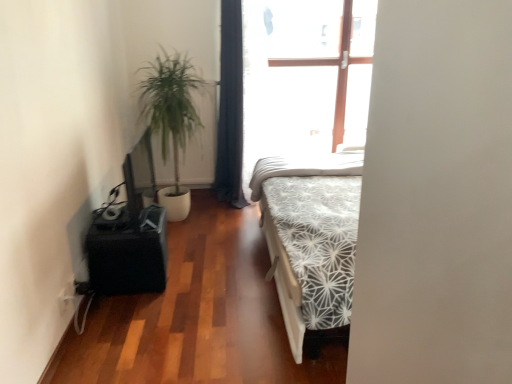
The image size is (512, 384). Describe the element at coordinates (305, 167) in the screenshot. I see `white textured mattress at center` at that location.

Where is `black matte table at left`? black matte table at left is located at coordinates (128, 253).

Image resolution: width=512 pixels, height=384 pixels. What are the coordinates of `white textured mattress at center` in the screenshot? It's located at (305, 167).

Between point (241, 164) and point (163, 204), which one is positioned in front?

Positioned in front is point (163, 204).

From the image's perspective, is dark blue fabric curtain at center positioned above or below green leafy plant at left?

From the image's perspective, dark blue fabric curtain at center appears above green leafy plant at left.

Where is `curtain that appears above the green leafy plant at left (from a real-world perspective)`? curtain that appears above the green leafy plant at left (from a real-world perspective) is located at coordinates (230, 109).

Is green leafy plant at left surrounding white textured screen door at center?

No, white textured screen door at center is located outside of green leafy plant at left.

Which is behind, green leafy plant at left or white textured screen door at center?

green leafy plant at left is further away from the camera.

From their relative heights in the image, would you say green leafy plant at left is taller or shorter than white textured screen door at center?

In the image, green leafy plant at left appears to be taller than white textured screen door at center.

Based on their sizes in the image, would you say green leafy plant at left is bigger or smaller than white textured screen door at center?

In the image, green leafy plant at left appears to be smaller than white textured screen door at center.

How different are the orientations of white textured mattress at center and dark blue fabric curtain at center in degrees?

The facing directions of white textured mattress at center and dark blue fabric curtain at center are 91.4 degrees apart.

Is white textured mattress at center next to dark blue fabric curtain at center?

white textured mattress at center and dark blue fabric curtain at center are clearly separated.

From a real-world perspective, between white textured mattress at center and dark blue fabric curtain at center, who is vertically higher?

dark blue fabric curtain at center.

Is white textured mattress at center to the right of dark blue fabric curtain at center from the viewer's perspective?

Yes, white textured mattress at center is to the right of dark blue fabric curtain at center.

Based on the photo, are white textured mattress at center and white textured screen door at center beside each other?

white textured mattress at center and white textured screen door at center are clearly separated.

Looking at this image, between white textured mattress at center and white textured screen door at center, which one has more height?

Standing taller between the two is white textured screen door at center.

Can you tell me how much white textured mattress at center and white textured screen door at center differ in facing direction?

They differ by 0.784 degrees in their facing directions.

What are the coordinates of `mattress that is behind the white textured screen door at center` in the screenshot? It's located at (305, 167).

Considering the positions of point (283, 160) and point (101, 252), is point (283, 160) closer or farther from the camera than point (101, 252)?

Point (283, 160) is farther from the camera than point (101, 252).

Where is `table on the left of white textured mattress at center`? The height and width of the screenshot is (384, 512). table on the left of white textured mattress at center is located at coordinates (128, 253).

Which is more to the right, white textured mattress at center or black matte table at left?

white textured mattress at center is more to the right.

Is white textured mattress at center in front of or behind black matte table at left in the image?

white textured mattress at center is positioned farther from the viewer than black matte table at left.

Does point (174, 150) lie behind point (145, 272)?

Yes, it is behind point (145, 272).

From a real-world perspective, is green leafy plant at left positioned under black matte table at left based on gravity?

Incorrect, from a real-world perspective, green leafy plant at left is higher than black matte table at left.

What are the coordinates of `table located below the green leafy plant at left (from the image's perspective)` in the screenshot? It's located at (128, 253).

Is point (154, 206) positioned in front of point (162, 138)?

Yes, it is in front of point (162, 138).

Considering the relative sizes of black matte table at left and green leafy plant at left in the image provided, is black matte table at left wider than green leafy plant at left?

Incorrect, the width of black matte table at left does not surpass that of green leafy plant at left.

From a real-world perspective, is black matte table at left under green leafy plant at left?

Yes, from a real-world perspective, black matte table at left is below green leafy plant at left.

Image resolution: width=512 pixels, height=384 pixels. What are the coordinates of `houseplant that appears in front of the dark blue fabric curtain at center` in the screenshot? It's located at (170, 119).

Where is `screen door that appears below the green leafy plant at left (from a real-world perspective)`? This screenshot has height=384, width=512. screen door that appears below the green leafy plant at left (from a real-world perspective) is located at coordinates (436, 198).

Based on their spatial positions, is green leafy plant at left or dark blue fabric curtain at center closer to white textured mattress at center?

Based on the image, dark blue fabric curtain at center appears to be nearer to white textured mattress at center.

When comparing their distances from white textured mattress at center, does green leafy plant at left or black matte table at left seem closer?

green leafy plant at left lies closer to white textured mattress at center than the other object.

Estimate the real-world distances between objects in this image. Which object is closer to dark blue fabric curtain at center, green leafy plant at left or white textured screen door at center?

green leafy plant at left.

From the image, which object appears to be nearer to green leafy plant at left, white textured mattress at center or white textured screen door at center?

white textured mattress at center.

Which object lies further to the anchor point green leafy plant at left, white textured mattress at center or dark blue fabric curtain at center?

Among the two, white textured mattress at center is located further to green leafy plant at left.

When comparing their distances from green leafy plant at left, does black matte table at left or white textured mattress at center seem further?

black matte table at left.

Which object lies nearer to the anchor point white textured screen door at center, green leafy plant at left or dark blue fabric curtain at center?

green leafy plant at left lies closer to white textured screen door at center than the other object.

Which object lies nearer to the anchor point black matte table at left, white textured screen door at center or white textured mattress at center?

white textured mattress at center is closer to black matte table at left.

Identify the location of table positioned between white textured screen door at center and white textured mattress at center from near to far. The width and height of the screenshot is (512, 384). (x=128, y=253).

Find the location of `houseplant between white textured screen door at center and white textured mattress at center along the z-axis`. houseplant between white textured screen door at center and white textured mattress at center along the z-axis is located at coordinates (170, 119).

At what (x,y) coordinates should I click in order to perform the action: click on curtain situated between black matte table at left and white textured mattress at center from left to right. Please return your answer as a coordinate pair (x, y). This screenshot has width=512, height=384. Looking at the image, I should click on (230, 109).

This screenshot has height=384, width=512. In order to click on houseplant located between black matte table at left and white textured mattress at center in the left-right direction in this screenshot , I will do `click(170, 119)`.